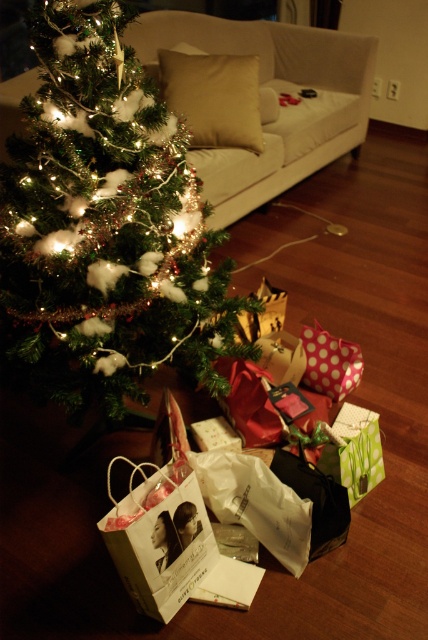
Which is in front, point (118, 250) or point (125, 570)?

Point (125, 570) is in front.

Can you confirm if green matte christmas tree at left is thinner than white paper gift bag at lower center?

In fact, green matte christmas tree at left might be wider than white paper gift bag at lower center.

Is point (80, 333) behind point (109, 481)?

No.

This screenshot has width=428, height=640. I want to click on green matte christmas tree at left, so click(x=106, y=227).